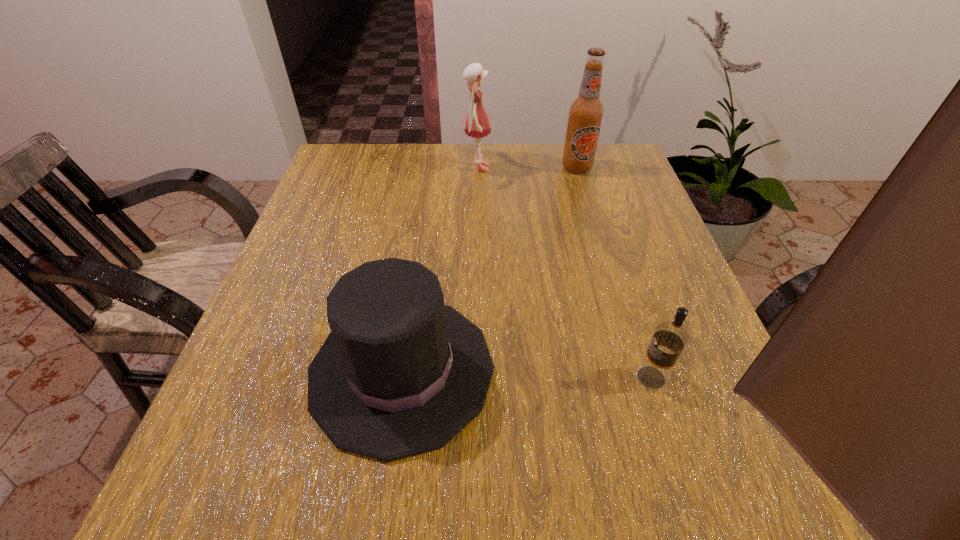
This screenshot has height=540, width=960. Identify the location of beer bottle. (585, 114).

This screenshot has height=540, width=960. I want to click on doll, so click(477, 123).

Find the location of a particular element. The width and height of the screenshot is (960, 540). dress hat is located at coordinates (400, 373).

Image resolution: width=960 pixels, height=540 pixels. What are the coordinates of `vodka` in the screenshot? It's located at (669, 339).

The height and width of the screenshot is (540, 960). What are the coordinates of `free spot located on the front label of the beer bottle` in the screenshot? It's located at (589, 211).

Image resolution: width=960 pixels, height=540 pixels. Identify the location of free space located 0.190m on the front-facing side of the doll. (564, 168).

At what (x,y) coordinates should I click in order to perform the action: click on vacant region located 0.200m on the front of the dress hat with the decoration. Please return your answer as a coordinate pair (x, y). Looking at the image, I should click on (615, 370).

Identify the location of vacant position located on the label of the vodka. (567, 377).

You are a GUI agent. You are given a task and a screenshot of the screen. Output one action in this format:
    pyautogui.click(x=<x>, y=<y>)
    Task: Click on the blank space located 0.260m on the label of the vodka
    The height and width of the screenshot is (540, 960).
    Given the screenshot: What is the action you would take?
    pyautogui.click(x=475, y=377)

Identify the location of vacant space located 0.140m on the label of the vodka. (549, 377).